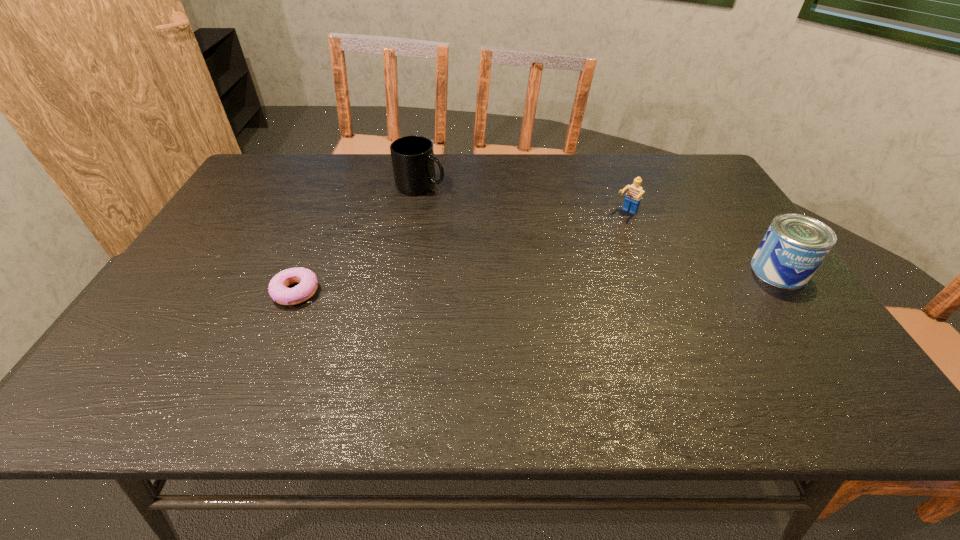
Image resolution: width=960 pixels, height=540 pixels. Find the location of `the shortest object`. the shortest object is located at coordinates (307, 280).

What are the coordinates of `doughnut` in the screenshot? It's located at (307, 280).

I want to click on the rightmost object, so click(x=794, y=246).

The width and height of the screenshot is (960, 540). I want to click on Lego, so click(633, 197).

Locate an element on the screen. The image size is (960, 540). the third object from left to right is located at coordinates (633, 197).

Image resolution: width=960 pixels, height=540 pixels. Find the location of `the farthest object`. the farthest object is located at coordinates (413, 161).

Identify the location of mug. (413, 161).

Image resolution: width=960 pixels, height=540 pixels. I want to click on vacant area situated 0.140m on the back of the shortest object, so click(x=317, y=241).

I want to click on vacant space situated 0.370m on the face of the third tallest object, so click(548, 288).

In order to click on free space located 0.050m on the face of the third tallest object in this screenshot , I will do `click(612, 227)`.